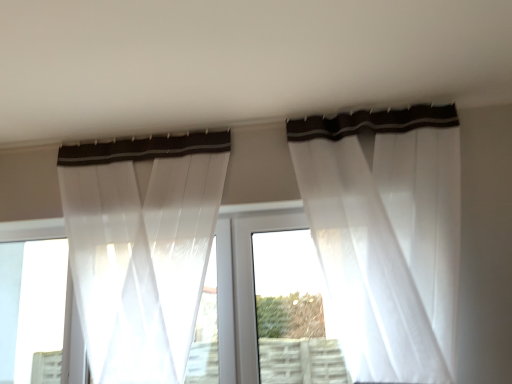
In order to face white plastic window frame at center, should I rotate leftwards or rightwards?

You should look right and rotate roughly 4.855 degrees.

What is the approximate width of sheer white curtain at left, placed as the 1th curtain when sorted from left to right?

It is 3.50 inches.

In order to click on white plastic window frame at center in this screenshot , I will do 274,289.

How much distance is there between sheer white curtain at upper center, positioned as the first curtain in right-to-left order, and white plastic window frame at center?

A distance of 17.24 inches exists between sheer white curtain at upper center, positioned as the first curtain in right-to-left order, and white plastic window frame at center.

Looking at this image, from a real-world perspective, is sheer white curtain at upper center, which appears as the 2th curtain when viewed from the left, under white plastic window frame at center?

No, from a real-world perspective, sheer white curtain at upper center, which appears as the 2th curtain when viewed from the left, is not under white plastic window frame at center.

From the picture: Is the position of sheer white curtain at upper center, which appears as the 2th curtain when viewed from the left, less distant than that of white plastic window frame at center?

Yes.

Consider the image. Is white plastic window frame at center facing towards sheer white curtain at upper center, which appears as the 2th curtain when viewed from the left?

No, white plastic window frame at center is not aimed at sheer white curtain at upper center, which appears as the 2th curtain when viewed from the left.

Considering the sizes of objects white plastic window frame at center and sheer white curtain at upper center, positioned as the first curtain in right-to-left order, in the image provided, who is bigger, white plastic window frame at center or sheer white curtain at upper center, positioned as the first curtain in right-to-left order,?

sheer white curtain at upper center, positioned as the first curtain in right-to-left order.

Which object is closer to the camera taking this photo, white plastic window frame at center or sheer white curtain at upper center, positioned as the first curtain in right-to-left order?

sheer white curtain at upper center, positioned as the first curtain in right-to-left order, is in front.

From a real-world perspective, which object rests below the other?

In real-world perspective, sheer white curtain at upper center, positioned as the first curtain in right-to-left order, is lower.

Between sheer white curtain at upper center, which appears as the 2th curtain when viewed from the left, and sheer white curtain at left, placed as the second curtain when sorted from right to left, which one has smaller size?

Smaller between the two is sheer white curtain at left, placed as the second curtain when sorted from right to left.

Is sheer white curtain at upper center, which appears as the 2th curtain when viewed from the left, oriented towards sheer white curtain at left, placed as the 1th curtain when sorted from left to right?

No.

Between point (307, 351) and point (95, 218), which one is positioned in front?

The point (95, 218) is closer to the camera.

Does white plastic window frame at center have a larger size compared to sheer white curtain at left, placed as the 1th curtain when sorted from left to right?

Incorrect, white plastic window frame at center is not larger than sheer white curtain at left, placed as the 1th curtain when sorted from left to right.

Could you measure the distance between white plastic window frame at center and sheer white curtain at left, placed as the second curtain when sorted from right to left?

They are 21.18 inches apart.

From the image's perspective, which one is positioned lower, white plastic window frame at center or sheer white curtain at left, placed as the second curtain when sorted from right to left?

white plastic window frame at center, from the image's perspective.

Does point (157, 346) lie in front of point (312, 363)?

Yes, it is in front of point (312, 363).

Between sheer white curtain at left, placed as the second curtain when sorted from right to left, and white plastic window frame at center, which one has smaller width?

sheer white curtain at left, placed as the second curtain when sorted from right to left, is thinner.

Considering the relative sizes of sheer white curtain at left, placed as the second curtain when sorted from right to left, and white plastic window frame at center in the image provided, is sheer white curtain at left, placed as the second curtain when sorted from right to left, shorter than white plastic window frame at center?

No.

From the image's perspective, who appears lower, sheer white curtain at left, placed as the 1th curtain when sorted from left to right, or white plastic window frame at center?

From the image's view, white plastic window frame at center is below.

Based on their positions, is sheer white curtain at left, placed as the second curtain when sorted from right to left, located to the left or right of sheer white curtain at upper center, which appears as the 2th curtain when viewed from the left?

sheer white curtain at left, placed as the second curtain when sorted from right to left, is to the left of sheer white curtain at upper center, which appears as the 2th curtain when viewed from the left.

Consider the image. In the image, is sheer white curtain at left, placed as the 1th curtain when sorted from left to right, positioned in front of or behind sheer white curtain at upper center, which appears as the 2th curtain when viewed from the left?

sheer white curtain at left, placed as the 1th curtain when sorted from left to right, is behind sheer white curtain at upper center, which appears as the 2th curtain when viewed from the left.

Can we say sheer white curtain at left, placed as the 1th curtain when sorted from left to right, lies outside sheer white curtain at upper center, which appears as the 2th curtain when viewed from the left?

Indeed, sheer white curtain at left, placed as the 1th curtain when sorted from left to right, is completely outside sheer white curtain at upper center, which appears as the 2th curtain when viewed from the left.

There is a white plastic window frame at center. Identify the location of the 1st curtain above it (from a real-world perspective). (386, 235).

The height and width of the screenshot is (384, 512). In the image, there is a sheer white curtain at upper center, which appears as the 2th curtain when viewed from the left. Identify the location of window frame below it (from the image's perspective). (274, 289).

Which object lies nearer to the anchor point sheer white curtain at upper center, which appears as the 2th curtain when viewed from the left, white plastic window frame at center or sheer white curtain at left, placed as the second curtain when sorted from right to left?

white plastic window frame at center is positioned closer to the anchor sheer white curtain at upper center, which appears as the 2th curtain when viewed from the left.

From the image, which object appears to be nearer to sheer white curtain at left, placed as the second curtain when sorted from right to left, white plastic window frame at center or sheer white curtain at upper center, positioned as the first curtain in right-to-left order?

Based on the image, white plastic window frame at center appears to be nearer to sheer white curtain at left, placed as the second curtain when sorted from right to left.

Based on their spatial positions, is sheer white curtain at upper center, positioned as the first curtain in right-to-left order, or white plastic window frame at center closer to sheer white curtain at left, placed as the second curtain when sorted from right to left?

The object closer to sheer white curtain at left, placed as the second curtain when sorted from right to left, is white plastic window frame at center.

Looking at the image, which one is located closer to white plastic window frame at center, sheer white curtain at upper center, positioned as the first curtain in right-to-left order, or sheer white curtain at left, placed as the second curtain when sorted from right to left?

Based on the image, sheer white curtain at upper center, positioned as the first curtain in right-to-left order, appears to be nearer to white plastic window frame at center.

Which object lies further to the anchor point sheer white curtain at upper center, which appears as the 2th curtain when viewed from the left, sheer white curtain at left, placed as the second curtain when sorted from right to left, or white plastic window frame at center?

Among the two, sheer white curtain at left, placed as the second curtain when sorted from right to left, is located further to sheer white curtain at upper center, which appears as the 2th curtain when viewed from the left.

Looking at the image, which one is located closer to white plastic window frame at center, sheer white curtain at left, placed as the 1th curtain when sorted from left to right, or sheer white curtain at upper center, positioned as the first curtain in right-to-left order?

sheer white curtain at upper center, positioned as the first curtain in right-to-left order, is positioned closer to the anchor white plastic window frame at center.

Locate an element on the screen. window frame between sheer white curtain at left, placed as the second curtain when sorted from right to left, and sheer white curtain at upper center, which appears as the 2th curtain when viewed from the left, in the horizontal direction is located at coordinates (274, 289).